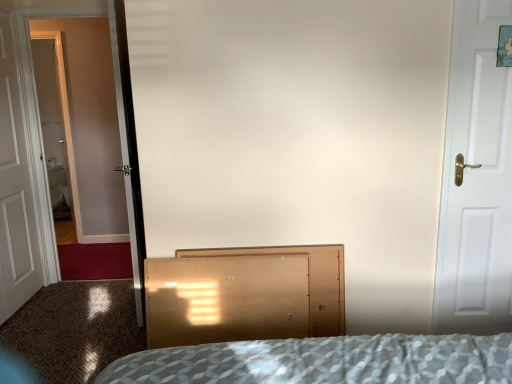
This screenshot has width=512, height=384. What do you see at coordinates (244, 295) in the screenshot?
I see `light brown wood dresser at center` at bounding box center [244, 295].

Identify the location of light brown wood dresser at center. This screenshot has width=512, height=384. (244, 295).

What is the approximate height of white wooden door at left, placed as the second door when sorted from front to back?

white wooden door at left, placed as the second door when sorted from front to back, is 6.71 feet tall.

At what (x,y) coordinates should I click in order to perform the action: click on clear glass screen door at left. Please return your answer as a coordinate pair (x, y). This screenshot has height=384, width=512. Looking at the image, I should click on (128, 148).

From the picture: In the image, is white matte door at right, acting as the second door starting from the left, on the left side or the right side of white wooden door at left, which appears as the first door when viewed from the left?

Based on their positions, white matte door at right, acting as the second door starting from the left, is located to the right of white wooden door at left, which appears as the first door when viewed from the left.

Does white matte door at right, which is the 1th door in right-to-left order, have a larger size compared to white wooden door at left, which appears as the first door when viewed from the left?

Yes.

Considering the relative positions of clear glass screen door at left and light brown wood dresser at center in the image provided, is clear glass screen door at left to the left of light brown wood dresser at center from the viewer's perspective?

Indeed, clear glass screen door at left is positioned on the left side of light brown wood dresser at center.

Who is taller, clear glass screen door at left or light brown wood dresser at center?

With more height is clear glass screen door at left.

Could you tell me if clear glass screen door at left is turned towards light brown wood dresser at center?

No, clear glass screen door at left is not aimed at light brown wood dresser at center.

From a real-world perspective, is light brown wood dresser at center under white matte door at right, acting as the second door starting from the left?

Yes, from a real-world perspective, light brown wood dresser at center is below white matte door at right, acting as the second door starting from the left.

Is point (320, 324) positioned behind point (485, 274)?

No, it is not.

Where is `door on the right of light brown wood dresser at center`? Image resolution: width=512 pixels, height=384 pixels. door on the right of light brown wood dresser at center is located at coordinates (476, 179).

From the image's perspective, which is above, white wooden door at left, which appears as the first door when viewed from the left, or clear glass screen door at left?

clear glass screen door at left is shown above in the image.

Considering the points (33, 291) and (109, 16), which point is behind, point (33, 291) or point (109, 16)?

The point (109, 16) is farther.

Is light brown wood dresser at center with white wooden door at left, placed as the second door when sorted from front to back?

No, light brown wood dresser at center is not in contact with white wooden door at left, placed as the second door when sorted from front to back.

In the scene shown: From a real-world perspective, which object rests below the other?

In real-world perspective, light brown wood dresser at center is lower.

Is point (193, 276) closer or farther from the camera than point (48, 242)?

Point (193, 276) appears to be closer to the viewer than point (48, 242).

Is clear glass screen door at left to the right of white wooden door at left, which appears as the first door when viewed from the left, from the viewer's perspective?

Yes, clear glass screen door at left is to the right of white wooden door at left, which appears as the first door when viewed from the left.

Is clear glass screen door at left bigger than white wooden door at left, which is the second door from right to left?

Indeed, clear glass screen door at left has a larger size compared to white wooden door at left, which is the second door from right to left.

The width and height of the screenshot is (512, 384). There is a clear glass screen door at left. Find the location of `the 1st door below it (from the image's perspective)`. the 1st door below it (from the image's perspective) is located at coordinates (20, 173).

Where is `dresser that is below the white wooden door at left, placed as the second door when sorted from front to back (from the image's perspective)`? This screenshot has width=512, height=384. dresser that is below the white wooden door at left, placed as the second door when sorted from front to back (from the image's perspective) is located at coordinates (244, 295).

Is white wooden door at left, placed as the second door when sorted from front to back, looking in the opposite direction of light brown wood dresser at center?

No, white wooden door at left, placed as the second door when sorted from front to back,'s orientation is not away from light brown wood dresser at center.

Would you say light brown wood dresser at center is part of white wooden door at left, which is the second door from right to left,'s contents?

No, light brown wood dresser at center is not surrounded by white wooden door at left, which is the second door from right to left.

Which is more to the right, white wooden door at left, placed as the second door when sorted from front to back, or light brown wood dresser at center?

light brown wood dresser at center.

The height and width of the screenshot is (384, 512). Identify the location of door that is on the left side of white matte door at right, acting as the second door starting from the left. (20, 173).

At what (x,y) coordinates should I click in order to perform the action: click on dresser below the clear glass screen door at left (from the image's perspective). Please return your answer as a coordinate pair (x, y). Image resolution: width=512 pixels, height=384 pixels. Looking at the image, I should click on (244, 295).

Which object lies further to the anchor point light brown wood dresser at center, white wooden door at left, which appears as the first door when viewed from the back, or white matte door at right, which is the 1th door in right-to-left order?

white wooden door at left, which appears as the first door when viewed from the back, is further to light brown wood dresser at center.

From the image, which object appears to be farther from white matte door at right, acting as the second door starting from the left, clear glass screen door at left or white wooden door at left, placed as the second door when sorted from front to back?

white wooden door at left, placed as the second door when sorted from front to back.

Based on their spatial positions, is clear glass screen door at left or white matte door at right, arranged as the second door when viewed from the back, further from white wooden door at left, which is the second door from right to left?

white matte door at right, arranged as the second door when viewed from the back, is positioned further to the anchor white wooden door at left, which is the second door from right to left.

Estimate the real-world distances between objects in this image. Which object is closer to clear glass screen door at left, light brown wood dresser at center or white wooden door at left, which is the second door from right to left?

Among the two, light brown wood dresser at center is located nearer to clear glass screen door at left.

Estimate the real-world distances between objects in this image. Which object is further from white wooden door at left, which appears as the first door when viewed from the left, light brown wood dresser at center or white matte door at right, arranged as the second door when viewed from the back?

white matte door at right, arranged as the second door when viewed from the back, lies further to white wooden door at left, which appears as the first door when viewed from the left, than the other object.

From the image, which object appears to be nearer to white matte door at right, which is the 1th door in right-to-left order, white wooden door at left, which is the second door from right to left, or clear glass screen door at left?

The object closer to white matte door at right, which is the 1th door in right-to-left order, is clear glass screen door at left.

From the image, which object appears to be farther from white wooden door at left, which is the second door from right to left, light brown wood dresser at center or clear glass screen door at left?

light brown wood dresser at center.

Looking at this image, estimate the real-world distances between objects in this image. Which object is closer to white matte door at right, the 1th door viewed from the front, light brown wood dresser at center or clear glass screen door at left?

light brown wood dresser at center is positioned closer to the anchor white matte door at right, the 1th door viewed from the front.

The width and height of the screenshot is (512, 384). In order to click on screen door between white wooden door at left, which is the second door from right to left, and light brown wood dresser at center from left to right in this screenshot , I will do `click(128, 148)`.

This screenshot has width=512, height=384. In order to click on screen door located between white wooden door at left, which appears as the first door when viewed from the back, and white matte door at right, acting as the second door starting from the left, in the left-right direction in this screenshot , I will do point(128,148).

Identify the location of dresser situated between white wooden door at left, which appears as the first door when viewed from the back, and white matte door at right, arranged as the second door when viewed from the back, from left to right. The width and height of the screenshot is (512, 384). (244, 295).

At what (x,y) coordinates should I click in order to perform the action: click on dresser located between clear glass screen door at left and white matte door at right, arranged as the second door when viewed from the back, in the left-right direction. Please return your answer as a coordinate pair (x, y). Looking at the image, I should click on (244, 295).